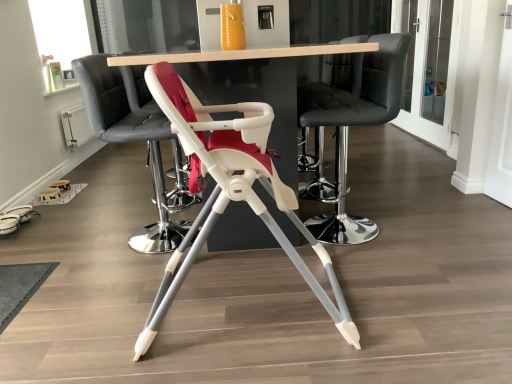
In order to click on vacant space to the left of white plastic highchair at center, marked as the 3th chair in a front-to-back arrangement in this screenshot , I will do `click(88, 241)`.